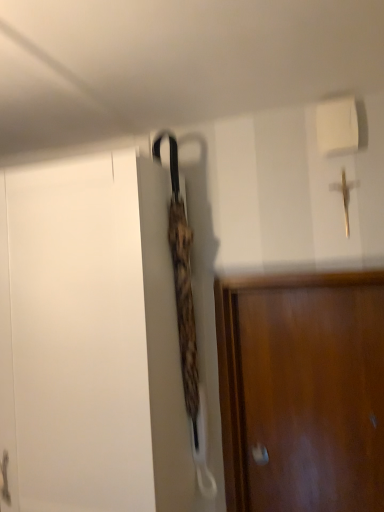
This screenshot has width=384, height=512. Identify the location of gold metallic cross at upper right. (345, 195).

Describe the element at coordinates (345, 195) in the screenshot. I see `gold metallic cross at upper right` at that location.

Locate an element on the screen. Image resolution: width=384 pixels, height=512 pixels. gold metallic cross at upper right is located at coordinates (345, 195).